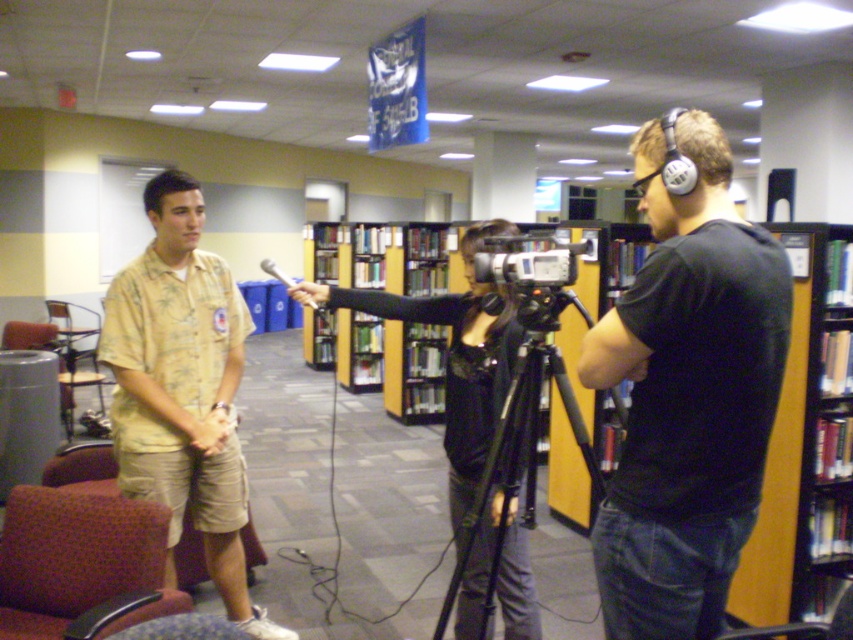
What is located at the coordinate point (805, 444) in the image?

The yellow wood bookcase at center is located at the coordinate point (805, 444).